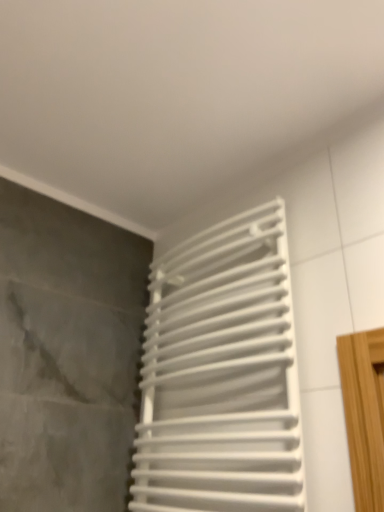
This screenshot has width=384, height=512. What are the coordinates of `white matte towel rack at center` in the screenshot? It's located at [221, 373].

The image size is (384, 512). What do you see at coordinates (221, 373) in the screenshot? I see `white matte towel rack at center` at bounding box center [221, 373].

The width and height of the screenshot is (384, 512). What are the coordinates of `white matte towel rack at center` in the screenshot? It's located at (221, 373).